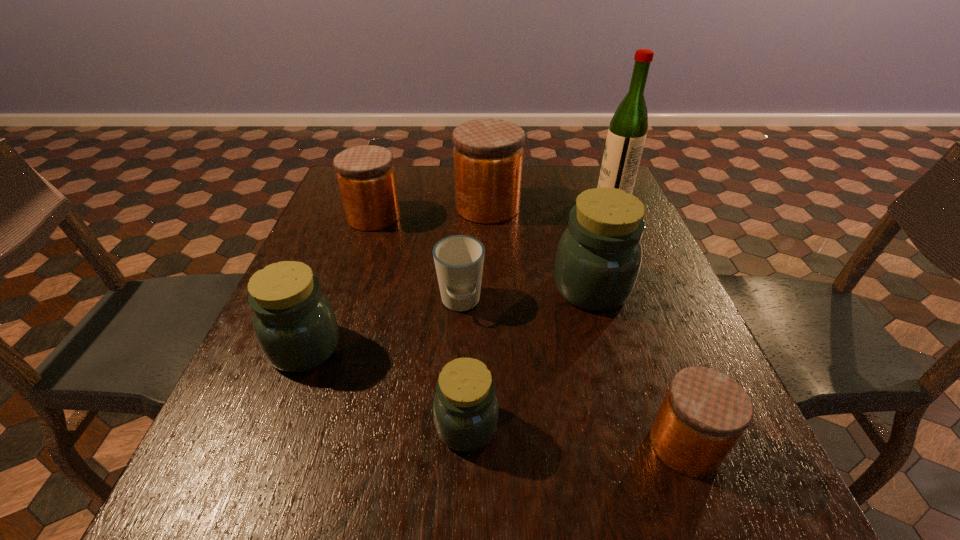
Find the location of a particular element. free space at the near edge of the desktop is located at coordinates (424, 481).

Locate an element on the screen. free space at the left edge is located at coordinates (343, 213).

The image size is (960, 540). I want to click on vacant area at the right edge of the desktop, so click(646, 340).

Find the location of a particular element. The width and height of the screenshot is (960, 540). vacant space that's between the biggest orange jar and the rightmost orange jar is located at coordinates (587, 326).

This screenshot has width=960, height=540. Identify the location of free space between the leftmost green jar and the second orange jar from right to left. (396, 277).

The height and width of the screenshot is (540, 960). I want to click on free space between the second orange jar from right to left and the second green jar from right to left, so click(x=477, y=316).

The image size is (960, 540). In order to click on free space between the tallest object and the cup in this screenshot , I will do `click(537, 249)`.

Where is `free space between the rightmost orange jar and the nearest green jar`? This screenshot has height=540, width=960. free space between the rightmost orange jar and the nearest green jar is located at coordinates (576, 435).

Locate which object ranks second in proximity to the third farthest jar. Please provide its 2D coordinates. Your answer should be formatted as a tuple, i.e. [(x, y)], where the tuple contains the x and y coordinates of a point satisfying the conditions above.

[(488, 153)]

Image resolution: width=960 pixels, height=540 pixels. I want to click on the third closest object relative to the second orange jar from right to left, so click(626, 136).